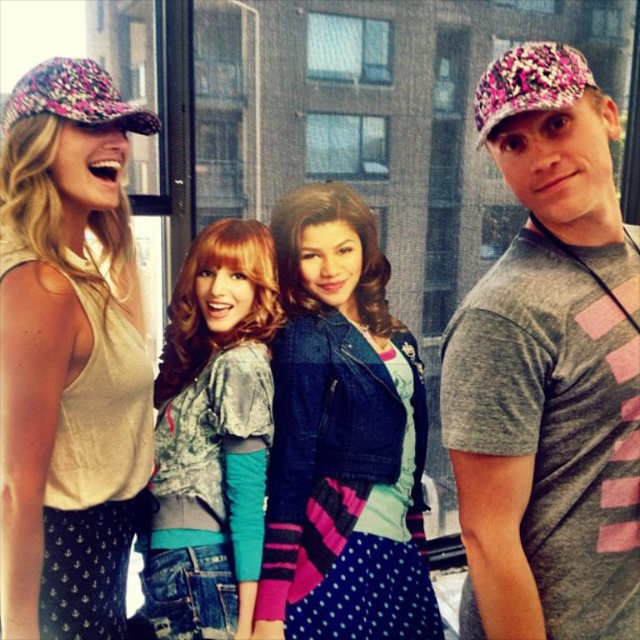
Is gray cotton t-shirt at right in front of distressed denim jacket at center?

Yes, gray cotton t-shirt at right is closer to the viewer.

Which is in front, point (497, 346) or point (224, 580)?

Point (497, 346) is more forward.

Image resolution: width=640 pixels, height=640 pixels. Find the location of `gray cotton t-shirt at right`. gray cotton t-shirt at right is located at coordinates (548, 371).

Is denim jacket at center thinner than distressed denim jacket at center?

In fact, denim jacket at center might be wider than distressed denim jacket at center.

Does denim jacket at center have a smaller size compared to distressed denim jacket at center?

No.

Identify the location of denim jacket at center. The height and width of the screenshot is (640, 640). (342, 436).

Which is more to the right, gray cotton t-shirt at right or matte floral cap at upper left?

gray cotton t-shirt at right

Measure the distance between gray cotton t-shirt at right and matte floral cap at upper left.

gray cotton t-shirt at right is 35.23 inches from matte floral cap at upper left.

Identify the location of gray cotton t-shirt at right. (548, 371).

Where is `gray cotton t-shirt at right`? Image resolution: width=640 pixels, height=640 pixels. gray cotton t-shirt at right is located at coordinates (548, 371).